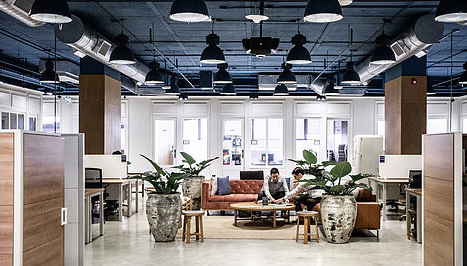
The width and height of the screenshot is (467, 266). Find the location of `2 desks on the right side`. 2 desks on the right side is located at coordinates (x=385, y=181), (x=418, y=195).